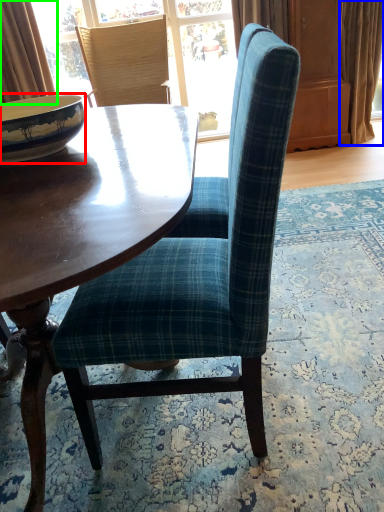
Question: Which object is the closest to the bowl (highlighted by a red box)? Choose among these: curtain (highlighted by a blue box) or curtain (highlighted by a green box).

Choices:
 (A) curtain
 (B) curtain

Answer: (B)